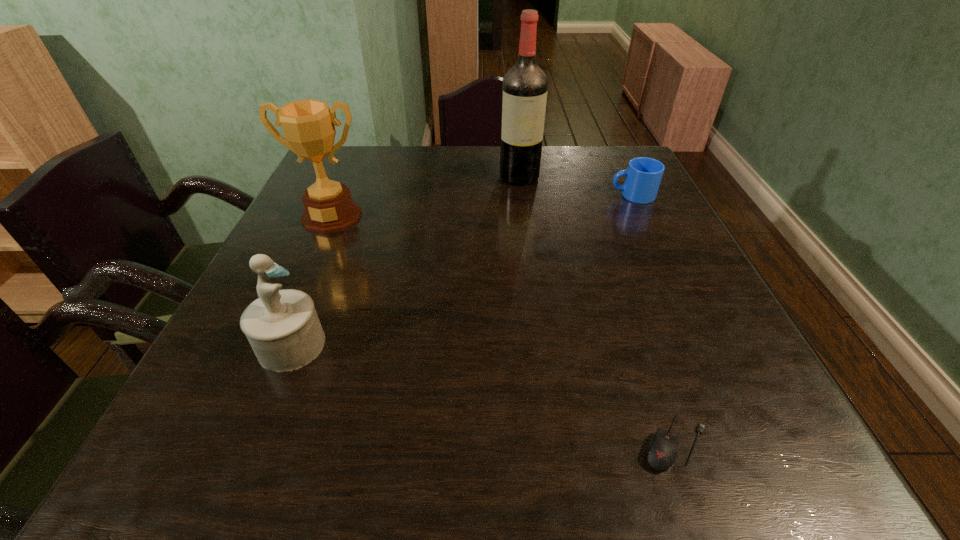
I want to click on vacant point located between the tallest object and the second tallest object, so click(x=425, y=197).

In order to click on free area in between the rightmost object and the fourth farthest object in this screenshot , I will do `click(462, 271)`.

In order to click on vacant region between the second shortest object and the third object from left to right in this screenshot , I will do `click(576, 186)`.

Where is `empty space between the tallest object and the second object from right to left`? The width and height of the screenshot is (960, 540). empty space between the tallest object and the second object from right to left is located at coordinates (597, 310).

Where is `empty space between the second object from right to left and the liquor`? The height and width of the screenshot is (540, 960). empty space between the second object from right to left and the liquor is located at coordinates (597, 310).

At what (x,y) coordinates should I click in order to perform the action: click on free space between the award and the third tallest object. Please return your answer as a coordinate pair (x, y). Image resolution: width=960 pixels, height=540 pixels. Looking at the image, I should click on (311, 281).

Where is `vacant space in between the fourth farthest object and the second shortest object`? This screenshot has width=960, height=540. vacant space in between the fourth farthest object and the second shortest object is located at coordinates (462, 271).

Where is `free point between the second tallest object and the nearest object`? Image resolution: width=960 pixels, height=540 pixels. free point between the second tallest object and the nearest object is located at coordinates (504, 329).

Where is `vacant space that's between the figurine and the second tallest object`? The width and height of the screenshot is (960, 540). vacant space that's between the figurine and the second tallest object is located at coordinates (311, 281).

Identify which object is the second closest to the fourth farthest object. Please provide its 2D coordinates. Your answer should be formatted as a tuple, i.e. [(x, y)], where the tuple contains the x and y coordinates of a point satisfying the conditions above.

[(662, 453)]